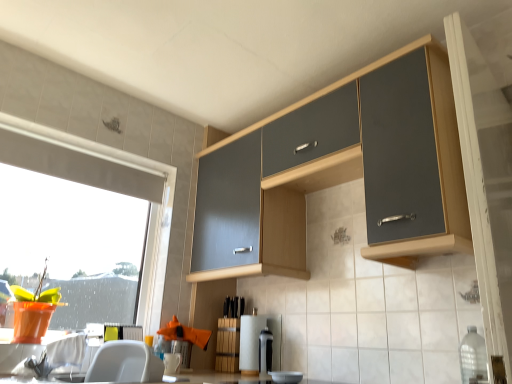
Measure the distance between matte gray cabinet at upper center and camera.

A distance of 1.29 meters exists between matte gray cabinet at upper center and camera.

The width and height of the screenshot is (512, 384). Describe the element at coordinates (473, 357) in the screenshot. I see `clear plastic bottle at lower right` at that location.

In order to face clear plastic bottle at lower right, should I rotate leftwards or rightwards?

A 27.574 degree turn to the right will do.

Where is `satin black coffee maker at lower center, the second appliance from the left`? satin black coffee maker at lower center, the second appliance from the left is located at coordinates (265, 352).

Describe the element at coordinates (486, 185) in the screenshot. This screenshot has height=384, width=512. I see `matte wood screen door at upper right` at that location.

Where is `transparent glass window at left`? Image resolution: width=512 pixels, height=384 pixels. transparent glass window at left is located at coordinates (82, 231).

You are a GUI agent. You are given a task and a screenshot of the screen. Output one action in this format:
    pyautogui.click(x=<x>, y=<y>)
    Task: Click on the bottle above the white glossy countertop at lower center (from a real-world perspective)
    Image resolution: width=512 pixels, height=384 pixels.
    Given the screenshot: What is the action you would take?
    pyautogui.click(x=473, y=357)

In the scene shown: Is white glossy countertop at lower center beside clear plastic bottle at lower right?

No, white glossy countertop at lower center is not beside clear plastic bottle at lower right.

In the scene shown: Is white glossy countertop at lower center wider or thinner than clear plastic bottle at lower right?

white glossy countertop at lower center is wider than clear plastic bottle at lower right.

Does matte gray cabinet at upper center lie in front of transparent glass window at left?

Yes, it is.

Which point is more distant from viewer, [222,240] or [2,247]?

The point [222,240] is more distant.

Does matte gray cabinet at upper center have a larger size compared to transparent glass window at left?

Yes, matte gray cabinet at upper center is bigger than transparent glass window at left.

Is matte gray cabinet at upper center not close to transparent glass window at left?

No, matte gray cabinet at upper center is in close proximity to transparent glass window at left.

Does point (86, 243) lie behind point (483, 144)?

Yes, it is behind point (483, 144).

Would you say transparent glass window at left is inside or outside matte wood screen door at upper right?

transparent glass window at left exists outside the volume of matte wood screen door at upper right.

Are transparent glass window at left and matte wood screen door at upper right beside each other?

transparent glass window at left is not next to matte wood screen door at upper right, and they're not touching.

Can you confirm if transparent glass window at left is taller than matte wood screen door at upper right?

In fact, transparent glass window at left may be shorter than matte wood screen door at upper right.

From a real-world perspective, does clear plastic bottle at lower right stand above matte gray cabinet at upper center?

Actually, clear plastic bottle at lower right is physically below matte gray cabinet at upper center in the real world.

How different are the orientations of clear plastic bottle at lower right and matte gray cabinet at upper center in degrees?

0.000702 degrees separate the facing orientations of clear plastic bottle at lower right and matte gray cabinet at upper center.

Looking at this image, are clear plastic bottle at lower right and matte gray cabinet at upper center located far from each other?

That's not correct — clear plastic bottle at lower right is a little close to matte gray cabinet at upper center.

From the image's perspective, which is below, clear plastic bottle at lower right or matte gray cabinet at upper center?

From the image's view, clear plastic bottle at lower right is below.

Is point (460, 32) closer to camera compared to point (266, 369)?

Yes, it is in front of point (266, 369).

From the image's perspective, does matte wood screen door at upper right appear higher than satin black coffee maker at lower center, the second appliance from the left?

Yes, from the image's perspective, matte wood screen door at upper right is above satin black coffee maker at lower center, the second appliance from the left.

From the picture: Is matte wood screen door at upper right not within satin black coffee maker at lower center, the second appliance from the left?

matte wood screen door at upper right is positioned outside satin black coffee maker at lower center, the second appliance from the left.

Considering the sizes of objects satin black coffee maker at lower center, the second appliance from the left, and transparent glass window at left in the image provided, who is taller, satin black coffee maker at lower center, the second appliance from the left, or transparent glass window at left?

Standing taller between the two is transparent glass window at left.

Image resolution: width=512 pixels, height=384 pixels. Identify the location of window that is in front of the satin black coffee maker at lower center, the second appliance from the left. (82, 231).

Is point (265, 376) closer or farther from the camera than point (7, 278)?

Point (265, 376) is farther from the camera than point (7, 278).

Can transparent glass window at left be found inside clear plastic bottle at lower right?

Definitely not — transparent glass window at left is not inside clear plastic bottle at lower right.

Is clear plastic bottle at lower right positioned with its back to transparent glass window at left?

No.

Are clear plastic bottle at lower right and transparent glass window at left located far from each other?

Yes, clear plastic bottle at lower right and transparent glass window at left are located far from each other.

Where is `countertop that appears on the left of clear plastic bottle at lower right`? countertop that appears on the left of clear plastic bottle at lower right is located at coordinates (217, 379).

You are a GUI agent. You are given a task and a screenshot of the screen. Output one action in this format:
    pyautogui.click(x=<x>, y=<y>)
    Task: Click on the cabinetry that appears in front of the transparent glass window at left
    This screenshot has height=384, width=512.
    Given the screenshot: What is the action you would take?
    pyautogui.click(x=344, y=170)

From the image, which object appears to be farther from clear plastic bottle at lower right, satin black coffee maker at lower center, the second appliance from the left, or white glossy countertop at lower center?

white glossy countertop at lower center lies further to clear plastic bottle at lower right than the other object.

When comparing their distances from transparent glass window at left, does clear plastic bottle at lower right or matte wood screen door at upper right seem closer?

clear plastic bottle at lower right is positioned closer to the anchor transparent glass window at left.

Estimate the real-world distances between objects in this image. Which object is further from matte gray cabinet at upper center, white glossy countertop at lower center or satin black coffee maker at lower center, the second appliance from the left?

white glossy countertop at lower center.

Looking at the image, which one is located closer to matte gray cabinet at upper center, transparent glass window at left or satin black coffee maker at lower center, which is counted as the 1th appliance, starting from the right?

Based on the image, transparent glass window at left appears to be nearer to matte gray cabinet at upper center.

From the image, which object appears to be farther from matte wood screen door at upper right, satin black coffee maker at lower center, the second appliance from the left, or white paper towel at center, the 2th appliance when ordered from right to left?

Among the two, satin black coffee maker at lower center, the second appliance from the left, is located further to matte wood screen door at upper right.

Based on the photo, based on their spatial positions, is transparent glass window at left or white glossy countertop at lower center further from matte wood screen door at upper right?

transparent glass window at left lies further to matte wood screen door at upper right than the other object.

Estimate the real-world distances between objects in this image. Which object is further from white glossy countertop at lower center, satin black coffee maker at lower center, the second appliance from the left, or matte wood screen door at upper right?

matte wood screen door at upper right is further to white glossy countertop at lower center.

When comparing their distances from white paper towel at center, the 2th appliance when ordered from right to left, does satin black coffee maker at lower center, which is counted as the 1th appliance, starting from the right, or matte wood screen door at upper right seem closer?

Based on the image, satin black coffee maker at lower center, which is counted as the 1th appliance, starting from the right, appears to be nearer to white paper towel at center, the 2th appliance when ordered from right to left.

This screenshot has width=512, height=384. What are the coordinates of `countertop between transparent glass window at left and matte wood screen door at upper right` in the screenshot? It's located at click(217, 379).

The image size is (512, 384). I want to click on bottle situated between white glossy countertop at lower center and matte wood screen door at upper right from left to right, so click(x=473, y=357).

The height and width of the screenshot is (384, 512). Find the location of `cabinetry located between transparent glass window at left and matte wood screen door at upper right in the left-right direction`. cabinetry located between transparent glass window at left and matte wood screen door at upper right in the left-right direction is located at coordinates (344, 170).

Where is `screen door that lies between matte gray cabinet at upper center and clear plastic bottle at lower right from top to bottom`? screen door that lies between matte gray cabinet at upper center and clear plastic bottle at lower right from top to bottom is located at coordinates (486, 185).